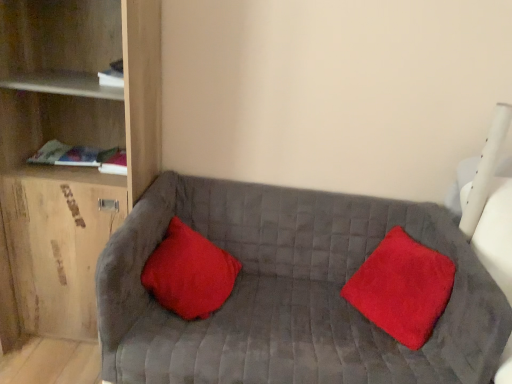
Question: From a real-world perspective, is red plush pillow at center, arranged as the second pillow when viewed from the left, physically located above or below red velvet pillow at center, acting as the 2th pillow starting from the right?

Choices:
 (A) below
 (B) above

Answer: (B)

Question: Considering the positions of red plush pillow at center, marked as the first pillow in a right-to-left arrangement, and red velvet pillow at center, acting as the 2th pillow starting from the right, in the image, is red plush pillow at center, marked as the first pillow in a right-to-left arrangement, taller or shorter than red velvet pillow at center, acting as the 2th pillow starting from the right,?

Choices:
 (A) tall
 (B) short

Answer: (A)

Question: Estimate the real-world distances between objects in this image. Which object is closer to the red plush pillow at center, arranged as the second pillow when viewed from the left?

Choices:
 (A) wooden shelf at left
 (B) velvet gray couch at center
 (C) red velvet pillow at center, which is the first pillow in left-to-right order

Answer: (B)

Question: Estimate the real-world distances between objects in this image. Which object is closer to the red velvet pillow at center, which is the first pillow in left-to-right order?

Choices:
 (A) red plush pillow at center, arranged as the second pillow when viewed from the left
 (B) wooden shelf at left
 (C) velvet gray couch at center

Answer: (C)